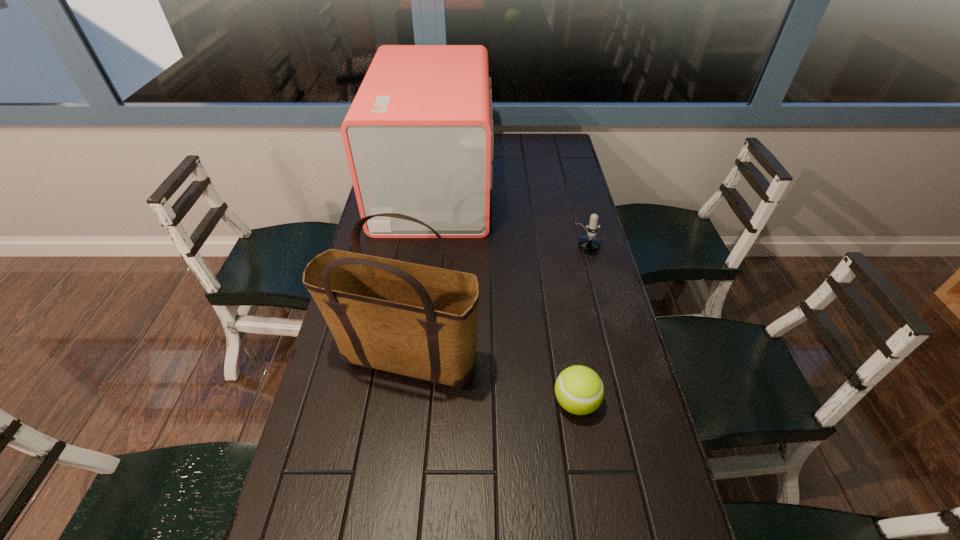
At what (x,y) coordinates should I click in order to perform the action: click on free point between the box and the second object from right to left. Please return your answer as a coordinate pair (x, y). Image resolution: width=960 pixels, height=540 pixels. Looking at the image, I should click on (505, 294).

The height and width of the screenshot is (540, 960). I want to click on free space between the tote bag and the microphone, so click(495, 299).

What are the coordinates of `vacant space in between the shortest object and the tote bag` in the screenshot? It's located at (491, 381).

Locate which object ranks third in proximity to the box. Please provide its 2D coordinates. Your answer should be formatted as a tuple, i.e. [(x, y)], where the tuple contains the x and y coordinates of a point satisfying the conditions above.

[(579, 390)]

Point out which object is positioned as the second nearest to the shortest object. Please provide its 2D coordinates. Your answer should be formatted as a tuple, i.e. [(x, y)], where the tuple contains the x and y coordinates of a point satisfying the conditions above.

[(589, 243)]

Locate an element on the screen. This screenshot has height=540, width=960. free space that satisfies the following two spatial constraints: 1. on the back side of the second object from right to left; 2. on the right side of the microphone is located at coordinates (548, 239).

Image resolution: width=960 pixels, height=540 pixels. In order to click on free region that satisfies the following two spatial constraints: 1. on the surface of the box where the text is embossed; 2. on the right side of the rightmost object in this screenshot , I will do `click(427, 239)`.

Find the location of `vacant area in the image that satisfies the following two spatial constraints: 1. on the surface of the box where the text is embossed; 2. on the left side of the third tallest object`. vacant area in the image that satisfies the following two spatial constraints: 1. on the surface of the box where the text is embossed; 2. on the left side of the third tallest object is located at coordinates (427, 239).

The width and height of the screenshot is (960, 540). Identify the location of vacant space that satisfies the following two spatial constraints: 1. on the back side of the tennis ball; 2. on the left side of the third tallest object. tap(548, 239).